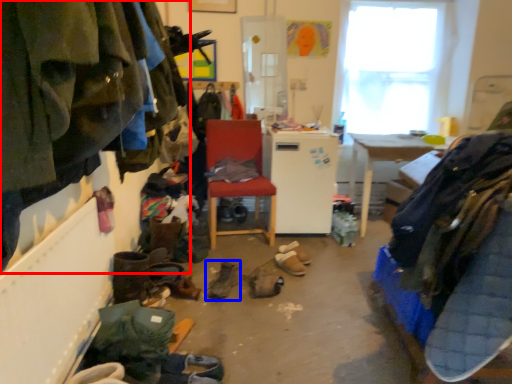
Question: Which object appears farthest to the camera in this image, clothing (highlighted by a red box) or footwear (highlighted by a blue box)?

Choices:
 (A) clothing
 (B) footwear

Answer: (B)